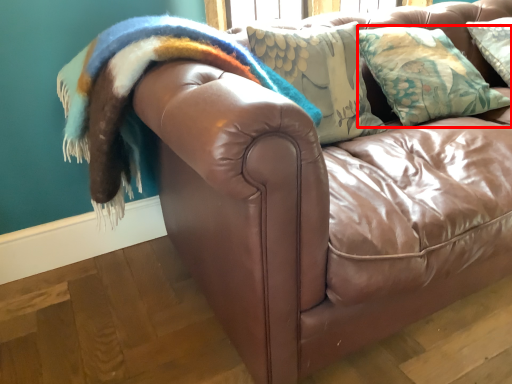
Question: From the image's perspective, considering the relative positions of pillow (annotated by the red box) and blanket in the image provided, where is pillow (annotated by the red box) located with respect to the staircase?

Choices:
 (A) above
 (B) below

Answer: (A)